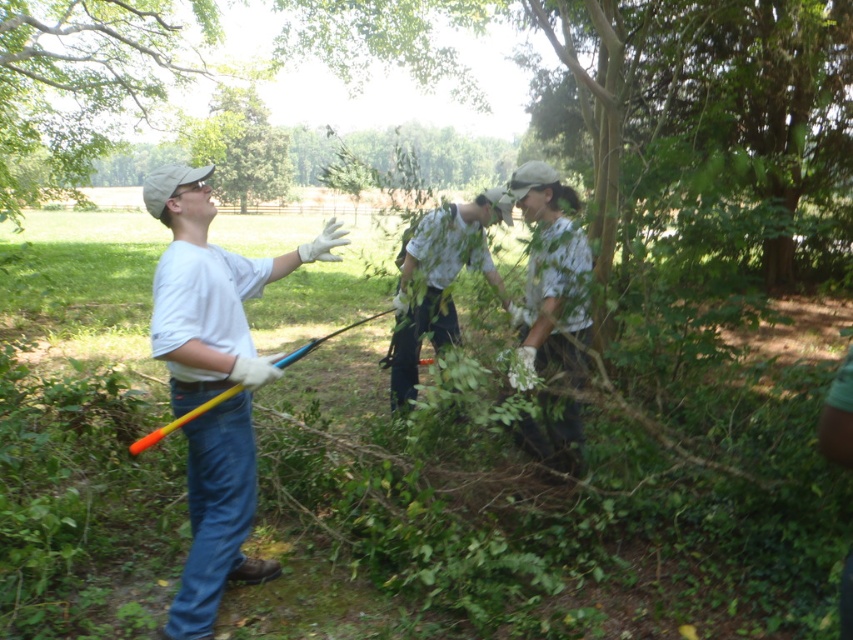
Question: Which point is closer to the camera taking this photo?

Choices:
 (A) (224, 452)
 (B) (573, 292)

Answer: (A)

Question: Among these points, which one is farthest from the camera?

Choices:
 (A) (213, 282)
 (B) (461, 211)
 (C) (77, 4)
 (D) (556, 262)

Answer: (C)

Question: Which point is farther to the camera?

Choices:
 (A) (206, 378)
 (B) (535, 342)
 (C) (416, 372)
 (D) (15, 20)

Answer: (D)

Question: Does white cotton shirt at center have a larger size compared to light gray cotton shirt at center?

Choices:
 (A) yes
 (B) no

Answer: (B)

Question: Is white matte shirt at left positioned behind green leafy tree at upper left?

Choices:
 (A) no
 (B) yes

Answer: (A)

Question: Does white matte shirt at left have a smaller size compared to green leafy tree at upper left?

Choices:
 (A) no
 (B) yes

Answer: (B)